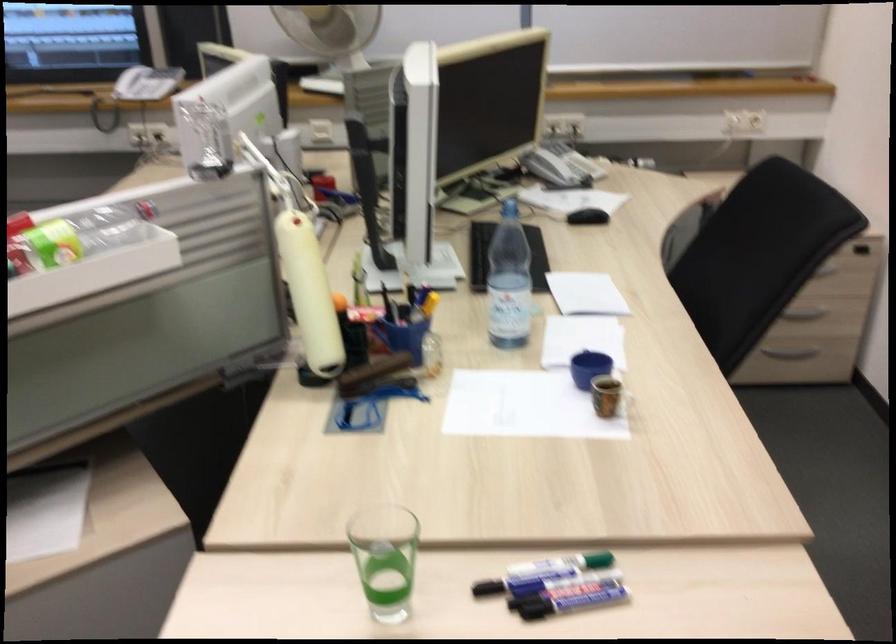
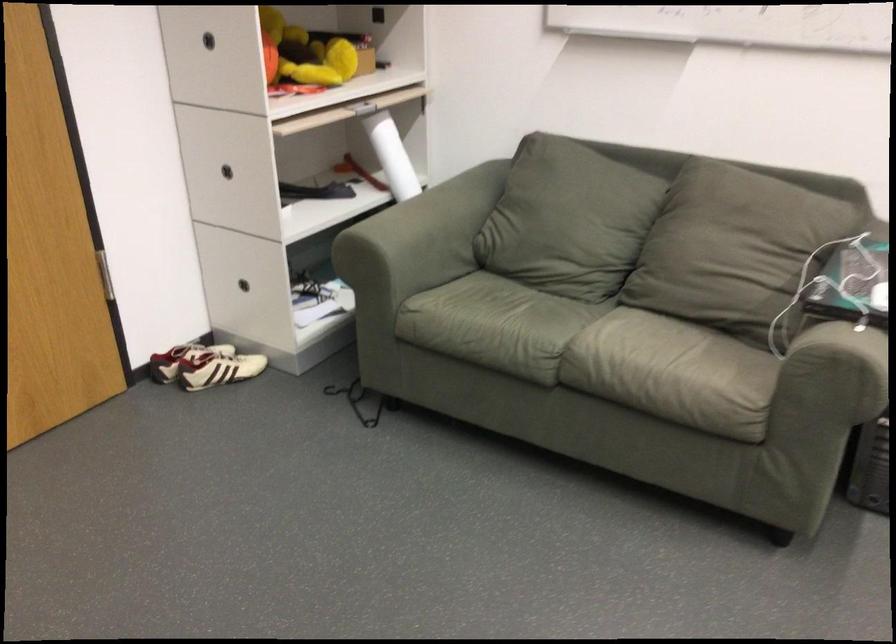
How did the camera likely rotate?

The rotation direction of the camera is left-down.